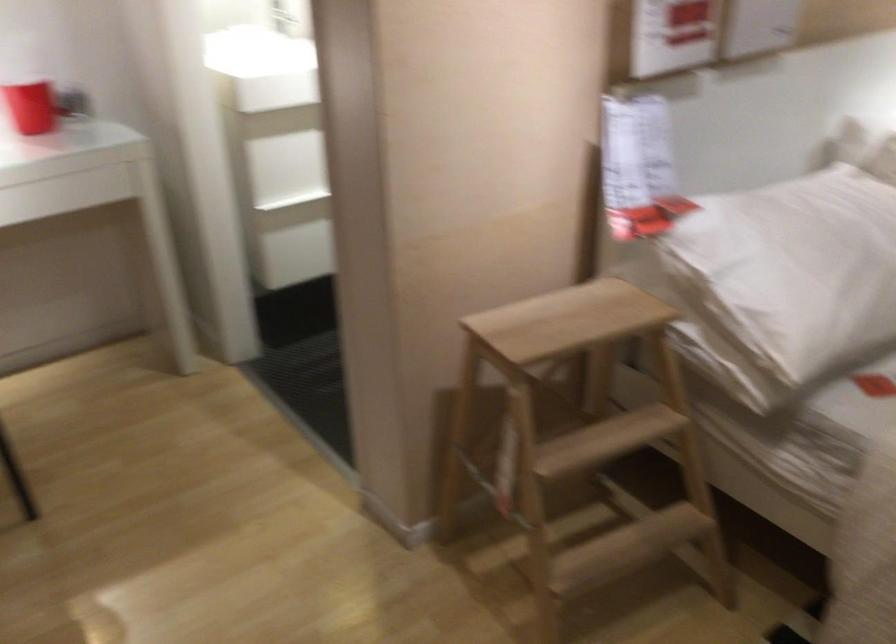
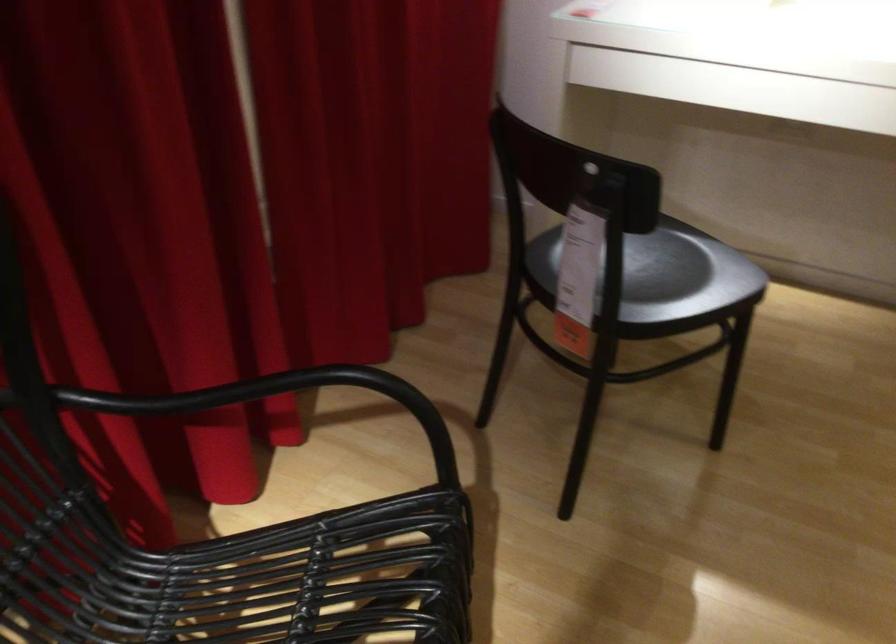
First-person continuous shooting, in which direction is the camera rotating?

The camera rotated toward left-down.